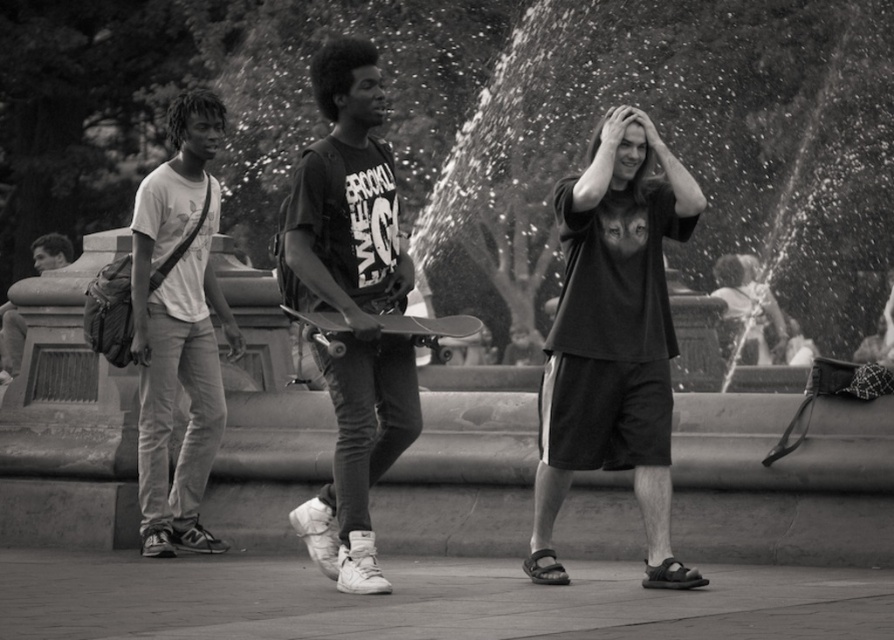
You are designing a storage compartment for skateboards and need to know which skateboard takes up more space in width between the matte black skateboard at center and the smooth black skateboard at center. According to the image, which one requires more width?

The smooth black skateboard at center requires more width because its width is greater than the matte black skateboard at center.